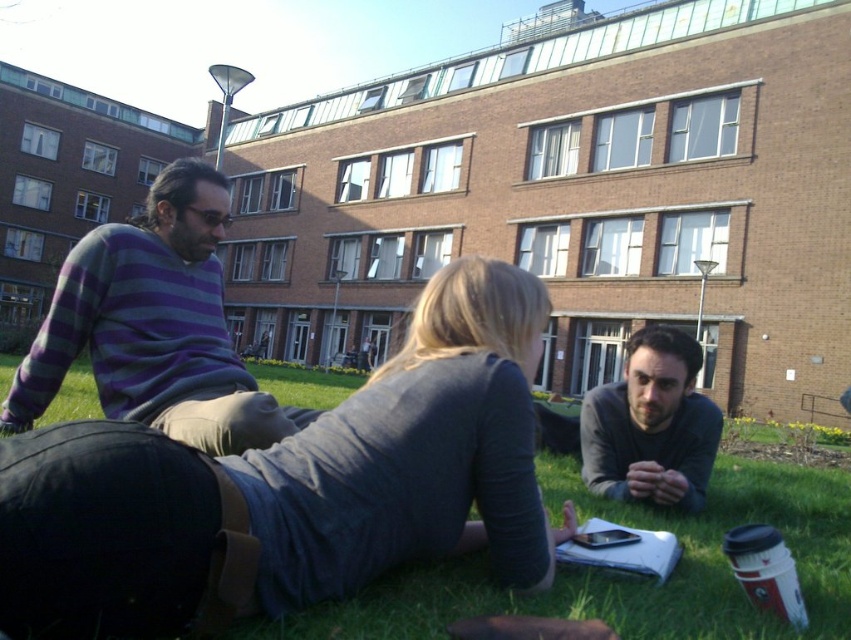
What are the coordinates of the dark gray sweater at center?

The dark gray sweater at center is located at coordinates point (292, 486).

You are a photographer trying to capture a photo of the dark gray sweater at center and the striped sweater at left. If you want to include both in the frame without moving the subjects, which sweater should you focus on first to ensure both are in focus?

The dark gray sweater at center is not as tall as the striped sweater at left, so you should focus on the striped sweater at left first since it is taller and will require more depth of field to keep both in focus.

Where is the striped sweater at left located in the image?

The striped sweater at left is located at point 0.509 on the x axis and 0.182 on the y axis.